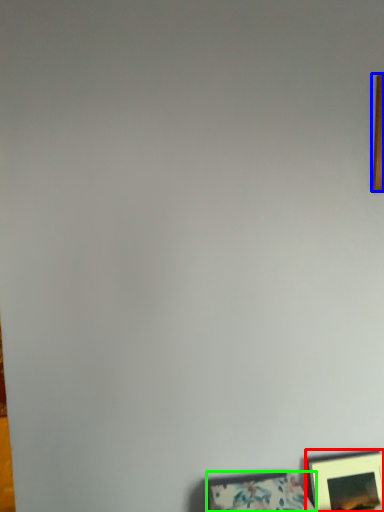
Question: Which is nearer to the picture frame (highlighted by a red box)? picture frame (highlighted by a blue box) or picture frame (highlighted by a green box).

Choices:
 (A) picture frame
 (B) picture frame

Answer: (B)